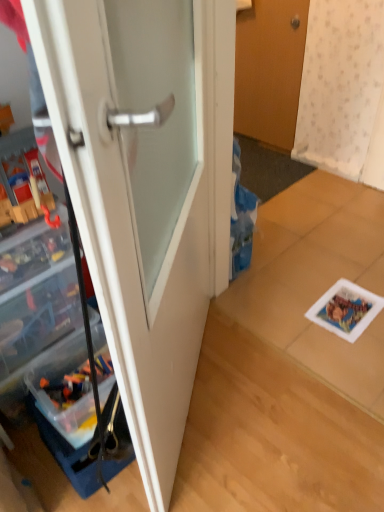
Locate an element on the screen. vacant space underneath white glossy door at center, placed as the 2th door when sorted from back to front (from a real-world perspective) is located at coordinates (200, 393).